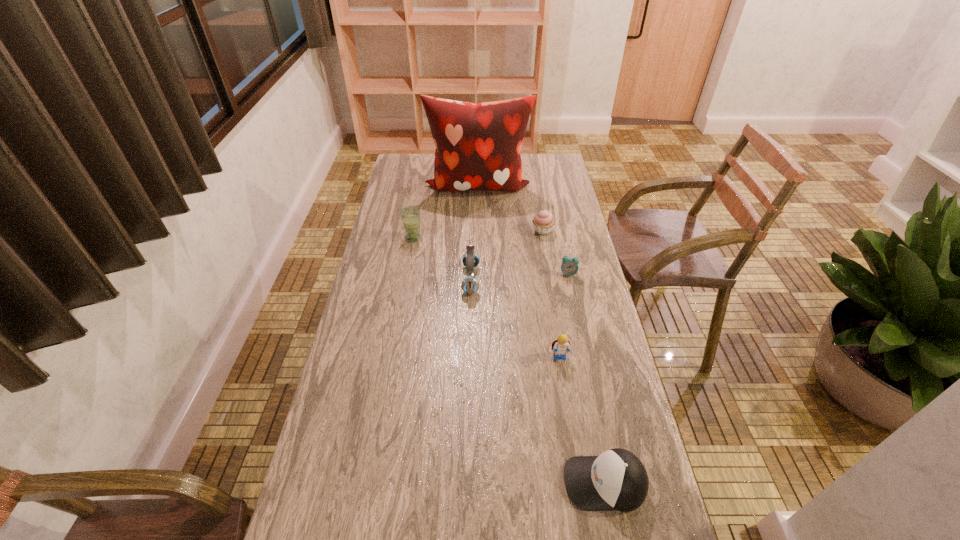
Image resolution: width=960 pixels, height=540 pixels. In order to click on free location located on the ear cups of the headset in this screenshot , I will do `click(580, 279)`.

This screenshot has height=540, width=960. I want to click on blank area located on the left of the cupcake, so click(492, 231).

Find the location of a particular element. This screenshot has height=540, width=960. free space located 0.080m on the front-facing side of the Lego is located at coordinates (564, 389).

In order to click on vacant region located on the front panel of the nearest object in this screenshot , I will do `click(401, 482)`.

Where is `blank space located 0.080m on the front panel of the nearest object`? This screenshot has width=960, height=540. blank space located 0.080m on the front panel of the nearest object is located at coordinates 530,482.

In order to click on vacant position located on the front panel of the nearest object in this screenshot , I will do `click(495, 482)`.

Find the location of a particular element. The image size is (960, 540). vacant space located on the face of the alarm clock is located at coordinates (574, 301).

In order to click on object that is at the far edge in this screenshot , I will do `click(478, 146)`.

The width and height of the screenshot is (960, 540). Identify the location of cushion positioned at the left edge. [x=478, y=146].

Image resolution: width=960 pixels, height=540 pixels. In order to click on glass positioned at the left edge in this screenshot , I will do `click(410, 215)`.